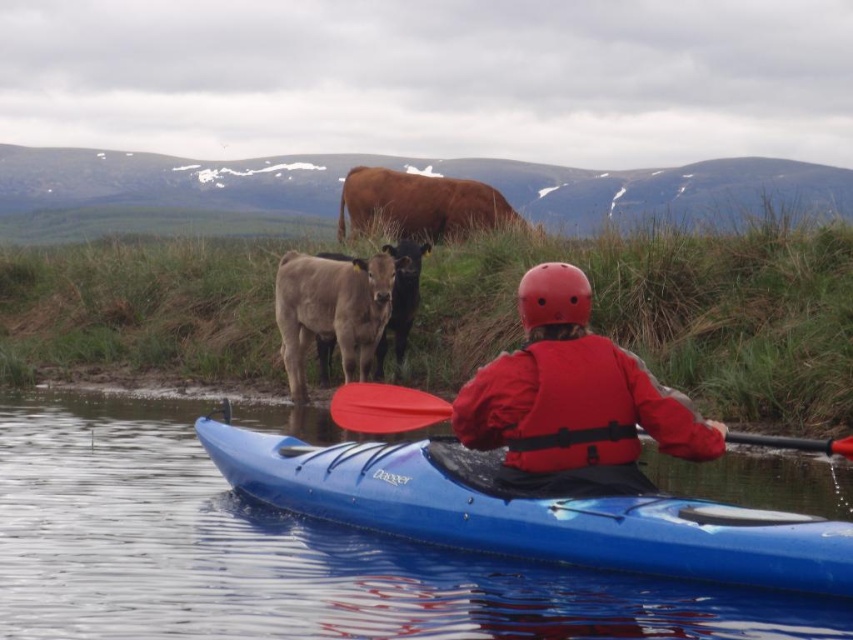
Is smooth brown calf at center taller than red matte helmet at center?

Indeed, smooth brown calf at center has a greater height compared to red matte helmet at center.

Is point (379, 333) positioned in front of point (576, 285)?

No, it is not.

I want to click on smooth brown calf at center, so click(x=331, y=310).

Locate an element on the screen. smooth brown calf at center is located at coordinates (331, 310).

Between blue plastic canoe at center and red plastic paddle at center, which one is positioned higher?

Positioned higher is red plastic paddle at center.

Where is `blue plastic canoe at center`? The height and width of the screenshot is (640, 853). blue plastic canoe at center is located at coordinates (527, 512).

This screenshot has width=853, height=640. Identify the location of blue plastic canoe at center. [x=527, y=512].

I want to click on blue plastic canoe at center, so click(527, 512).

How distant is red matte life vest at center from red plastic paddle at center?

red matte life vest at center and red plastic paddle at center are 71.06 centimeters apart.

Between point (577, 332) and point (833, 442), which one is positioned behind?

The point (577, 332) is more distant.

What are the coordinates of `red matte life vest at center` in the screenshot? It's located at (573, 400).